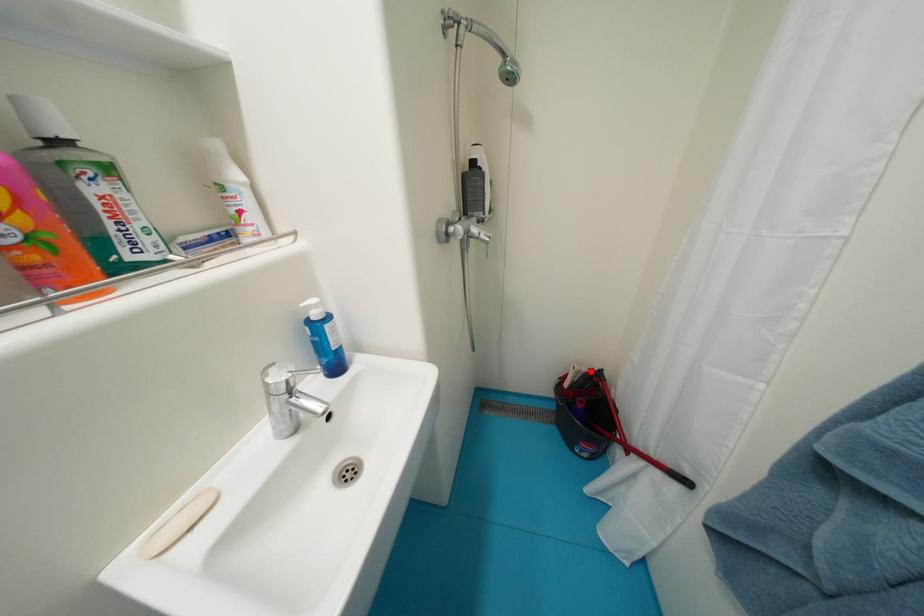
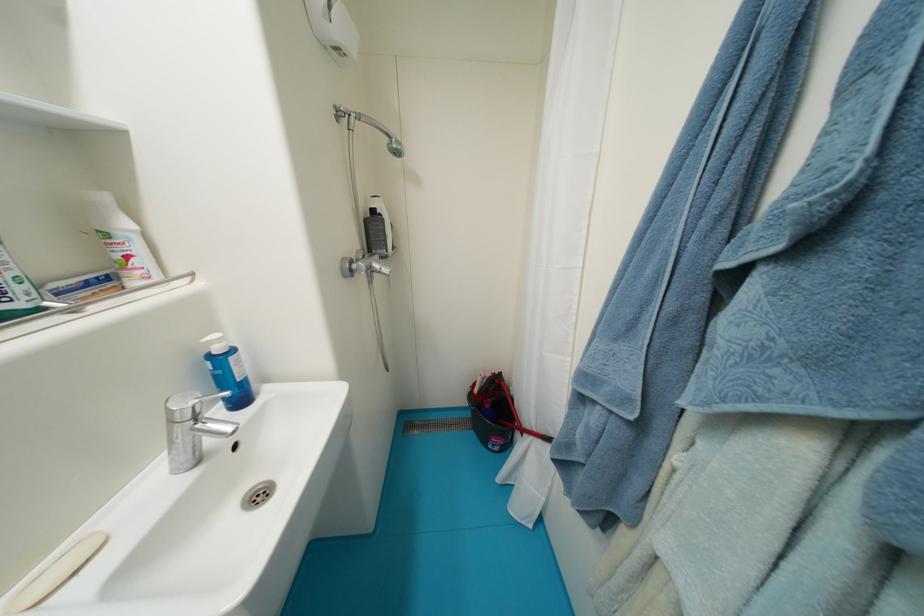
Where in the second image is the point corresponding to the highlighted location from the first image?

(495, 377)